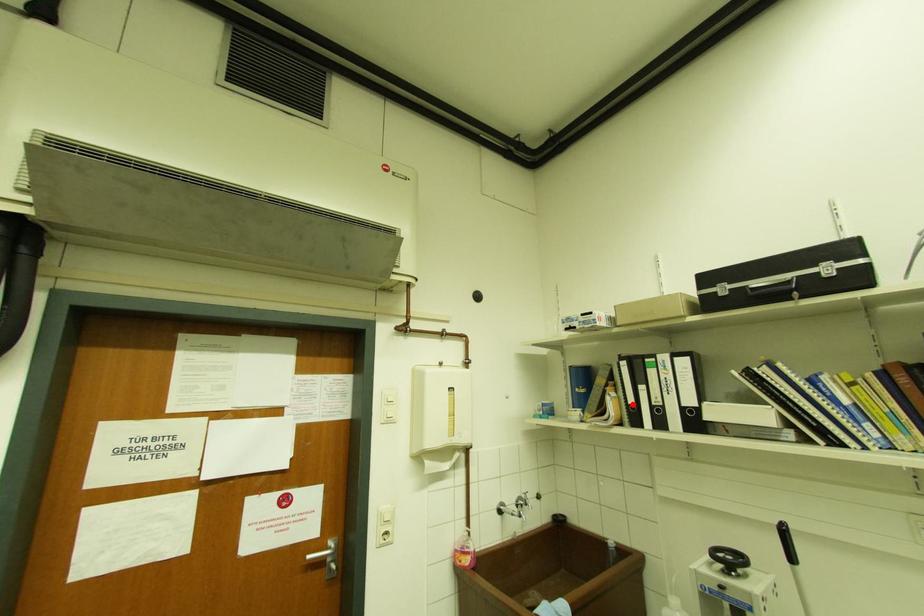
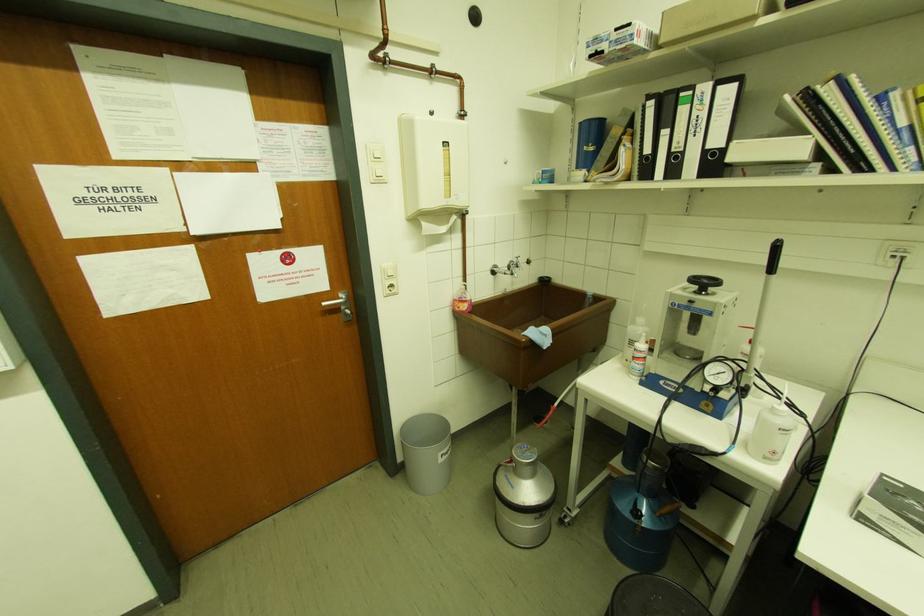
The point at the highlighted location is marked in the first image. Where is the corresponding point in the second image?

(648, 155)